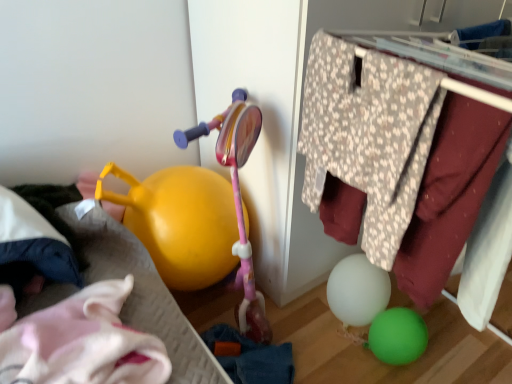
Question: Can you confirm if floral fabric clothes hanger at upper right is taller than white soft pillow at left?

Choices:
 (A) yes
 (B) no

Answer: (A)

Question: From a real-world perspective, is floral fabric clothes hanger at upper right on top of white soft pillow at left?

Choices:
 (A) no
 (B) yes

Answer: (B)

Question: Can you confirm if floral fabric clothes hanger at upper right is shorter than white soft pillow at left?

Choices:
 (A) no
 (B) yes

Answer: (A)

Question: From the image's perspective, is floral fabric clothes hanger at upper right located above white soft pillow at left?

Choices:
 (A) no
 (B) yes

Answer: (B)

Question: Considering the relative sizes of floral fabric clothes hanger at upper right and white soft pillow at left in the image provided, is floral fabric clothes hanger at upper right wider than white soft pillow at left?

Choices:
 (A) yes
 (B) no

Answer: (A)

Question: Is floral fabric clothes hanger at upper right smaller than white soft pillow at left?

Choices:
 (A) no
 (B) yes

Answer: (A)

Question: From the image's perspective, is white soft pillow at left under floral fabric clothes hanger at upper right?

Choices:
 (A) yes
 (B) no

Answer: (A)

Question: Does white soft pillow at left have a greater height compared to floral fabric clothes hanger at upper right?

Choices:
 (A) no
 (B) yes

Answer: (A)

Question: Are white soft pillow at left and floral fabric clothes hanger at upper right located far from each other?

Choices:
 (A) no
 (B) yes

Answer: (A)

Question: Considering the relative sizes of white soft pillow at left and floral fabric clothes hanger at upper right in the image provided, is white soft pillow at left smaller than floral fabric clothes hanger at upper right?

Choices:
 (A) no
 (B) yes

Answer: (B)

Question: Considering the relative positions of white soft pillow at left and floral fabric clothes hanger at upper right in the image provided, is white soft pillow at left to the left of floral fabric clothes hanger at upper right from the viewer's perspective?

Choices:
 (A) yes
 (B) no

Answer: (A)

Question: From the image's perspective, does white soft pillow at left appear higher than floral fabric clothes hanger at upper right?

Choices:
 (A) yes
 (B) no

Answer: (B)

Question: Can you confirm if white soft pillow at left is positioned to the right of yellow plastic watering can at left?

Choices:
 (A) yes
 (B) no

Answer: (B)